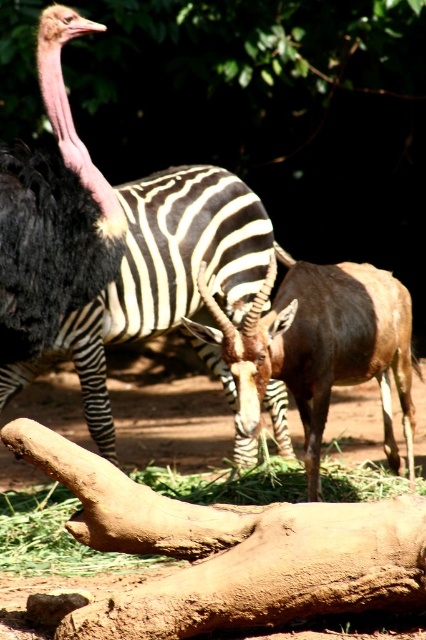
Question: Estimate the real-world distances between objects in this image. Which object is closer to the brown glossy antelope at center?

Choices:
 (A) green grass at lower center
 (B) black and white striped zebra at center
 (C) black feathered ostrich at left

Answer: (C)

Question: Estimate the real-world distances between objects in this image. Which object is closer to the brown glossy antelope at center?

Choices:
 (A) black and white striped zebra at center
 (B) black feathered ostrich at left

Answer: (B)

Question: Which point appears closest to the camera in this image?

Choices:
 (A) (195, 317)
 (B) (167, 499)
 (C) (405, 422)

Answer: (B)

Question: Does black and white striped zebra at center have a smaller size compared to green grass at lower center?

Choices:
 (A) no
 (B) yes

Answer: (A)

Question: Does black feathered ostrich at left have a smaller size compared to green grass at lower center?

Choices:
 (A) no
 (B) yes

Answer: (B)

Question: Does black and white striped zebra at center appear under green grass at lower center?

Choices:
 (A) no
 (B) yes

Answer: (A)